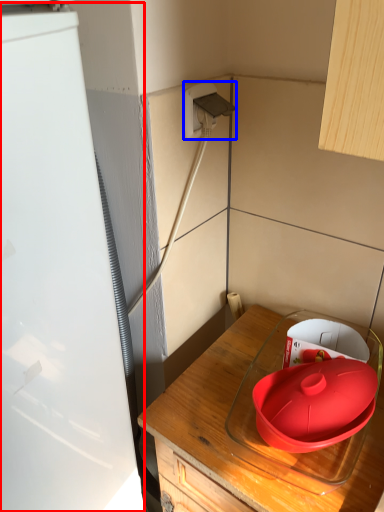
Question: Which object is closer to the camera taking this photo, appliance (highlighted by a red box) or electric outlet (highlighted by a blue box)?

Choices:
 (A) appliance
 (B) electric outlet

Answer: (A)